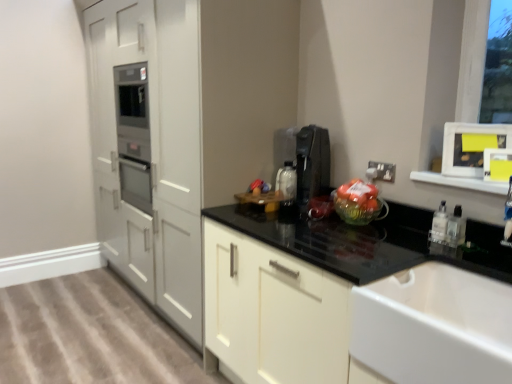
What are the coordinates of `free location above translucent glass bowl at center (from a real-world perspective)` in the screenshot? It's located at (354, 188).